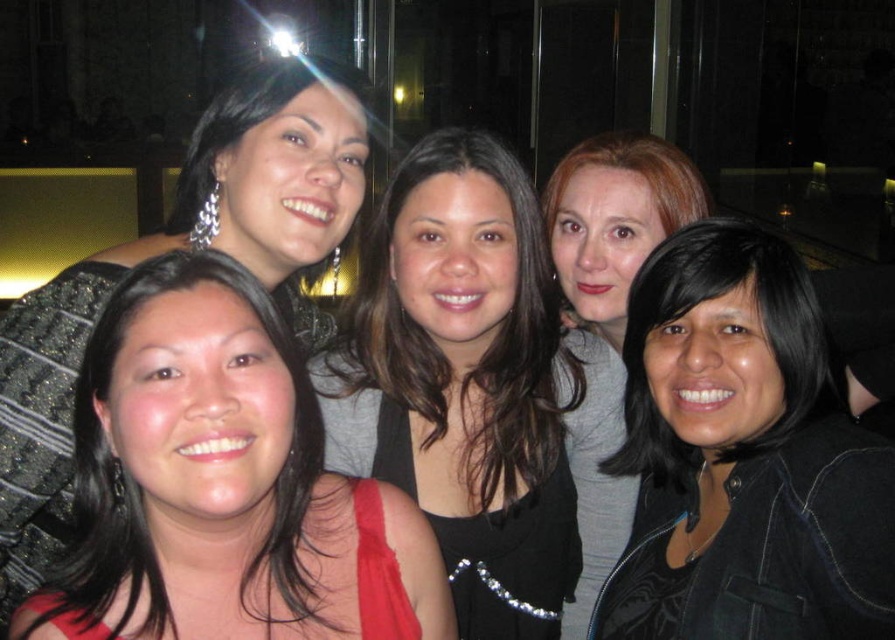
Question: Which of the following is the farthest from the observer?

Choices:
 (A) (424, 556)
 (B) (712, 465)

Answer: (B)

Question: Does shiny black dress at lower left have a lesser width compared to shiny black hair at center?

Choices:
 (A) yes
 (B) no

Answer: (B)

Question: Considering the relative positions of shiny black dress at lower left and shiny black hair at center in the image provided, where is shiny black dress at lower left located with respect to shiny black hair at center?

Choices:
 (A) below
 (B) above

Answer: (A)

Question: Considering the relative positions of shiny black dress at lower left and black matte jacket at lower right in the image provided, where is shiny black dress at lower left located with respect to black matte jacket at lower right?

Choices:
 (A) above
 (B) below

Answer: (B)

Question: Which object appears farthest from the camera in this image?

Choices:
 (A) shiny black hair at center
 (B) black matte jacket at lower right

Answer: (A)

Question: Among these objects, which one is nearest to the camera?

Choices:
 (A) black matte jacket at lower right
 (B) shiny black dress at lower left
 (C) shiny black hair at center

Answer: (B)